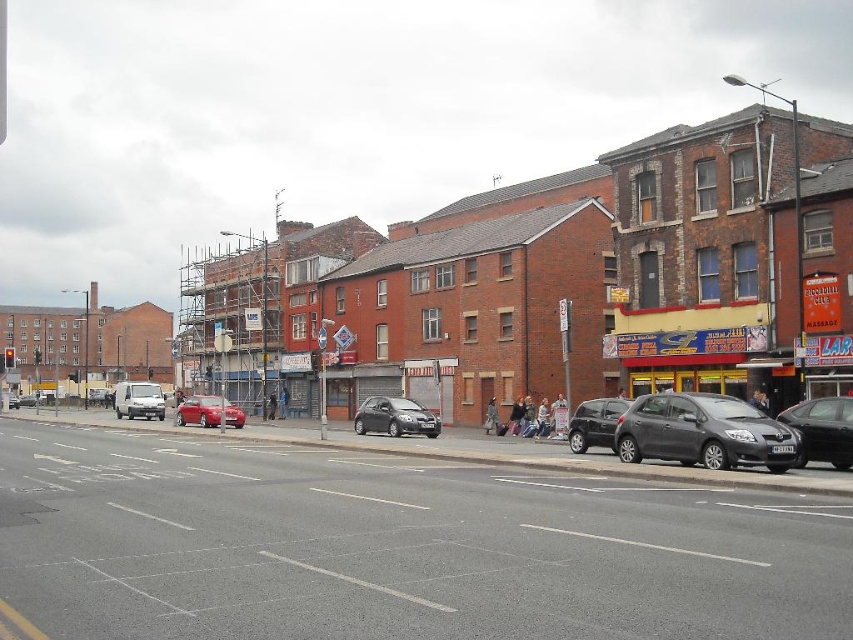
Between satin black car at lower right and metallic red car at center, which one has more height?

metallic red car at center is taller.

Can you confirm if satin black car at lower right is thinner than metallic red car at center?

Indeed, satin black car at lower right has a lesser width compared to metallic red car at center.

Where is `satin black car at lower right`? The image size is (853, 640). satin black car at lower right is located at coordinates (595, 422).

Is dark gray metallic hatchback at lower right closer to the viewer compared to satin black car at lower right?

Yes, dark gray metallic hatchback at lower right is closer to the viewer.

Is dark gray metallic hatchback at lower right wider than satin black car at lower right?

No, dark gray metallic hatchback at lower right is not wider than satin black car at lower right.

The width and height of the screenshot is (853, 640). What do you see at coordinates (703, 433) in the screenshot? I see `dark gray metallic hatchback at lower right` at bounding box center [703, 433].

Locate an element on the screen. The image size is (853, 640). dark gray metallic hatchback at lower right is located at coordinates (703, 433).

Does satin silver hatchback at center appear on the left side of metallic red car at center?

Incorrect, satin silver hatchback at center is not on the left side of metallic red car at center.

Who is positioned more to the right, satin silver hatchback at center or metallic red car at center?

satin silver hatchback at center

Is point (405, 406) behind point (225, 408)?

No, it is not.

The height and width of the screenshot is (640, 853). I want to click on satin silver hatchback at center, so click(x=393, y=417).